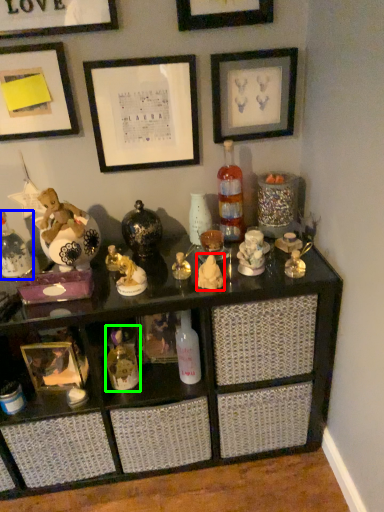
Question: Which object is the closest to the toy (highlighted by a red box)? Choose among these: bottle (highlighted by a blue box) or toy (highlighted by a green box).

Choices:
 (A) bottle
 (B) toy

Answer: (B)